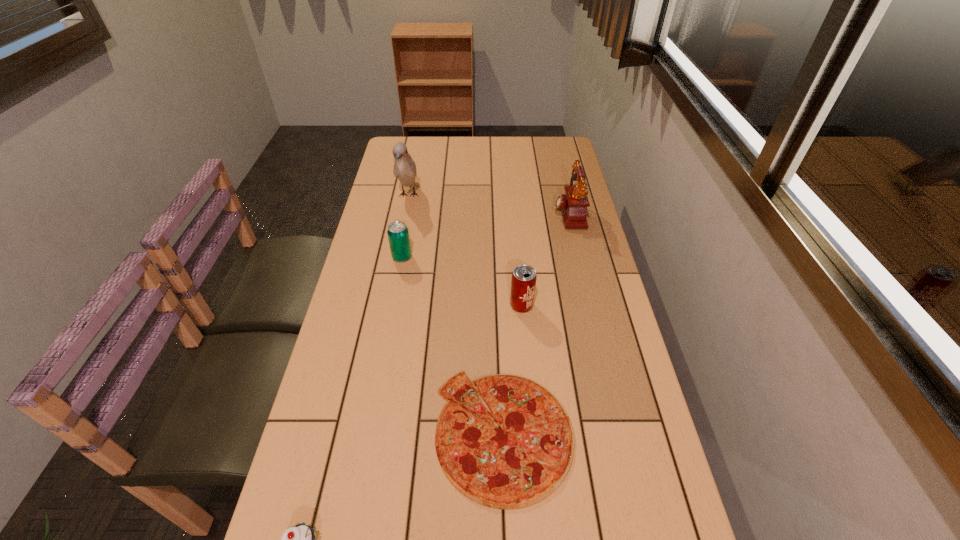
Where is `vacant region located 0.290m on the dial of the telephone`? The height and width of the screenshot is (540, 960). vacant region located 0.290m on the dial of the telephone is located at coordinates (468, 213).

In order to click on free space located on the dial of the telephone in this screenshot , I will do `click(440, 213)`.

This screenshot has width=960, height=540. In order to click on vacant position located 0.050m on the dial of the telephone in this screenshot , I will do `click(538, 213)`.

Locate an element on the screen. The height and width of the screenshot is (540, 960). vacant space situated 0.370m on the front of the right beer can is located at coordinates (534, 447).

Find the location of a particular element. The width and height of the screenshot is (960, 540). vacant space situated on the front of the third farthest object is located at coordinates (397, 282).

Find the location of a particular element. The height and width of the screenshot is (540, 960). free space located on the right of the fifth farthest object is located at coordinates (601, 434).

In order to click on bird situated at the left edge in this screenshot , I will do `click(404, 169)`.

Where is `beer can at the left edge`? Image resolution: width=960 pixels, height=540 pixels. beer can at the left edge is located at coordinates (398, 235).

You are a GUI agent. You are given a task and a screenshot of the screen. Output one action in this format:
    pyautogui.click(x=<x>, y=<y>)
    Task: Click on the object located in the right edge section of the desktop
    
    Given the screenshot: What is the action you would take?
    pyautogui.click(x=573, y=204)

In the image, there is a desktop. At what (x,y) coordinates should I click in order to perform the action: click on vacant space at the far edge. Please return your answer as a coordinate pair (x, y). Looking at the image, I should click on (455, 147).